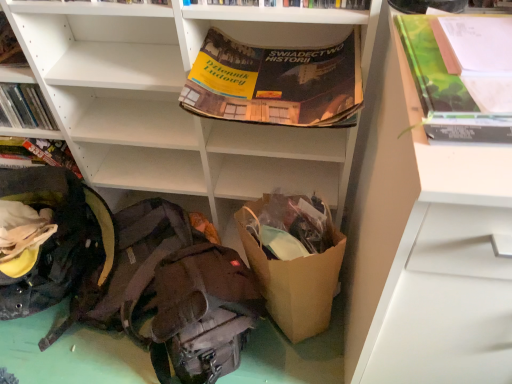
Question: From a real-world perspective, is dark brown fabric backpack at lower left, the third backpack from the left, on top of hardcover book at upper center, which is counted as the first book, starting from the front?

Choices:
 (A) no
 (B) yes

Answer: (A)

Question: Is dark brown fabric backpack at lower left, the third backpack from the left, positioned far away from hardcover book at upper center, which is the first book from top to bottom?

Choices:
 (A) no
 (B) yes

Answer: (A)

Question: Is hardcover book at upper center, marked as the second book in a back-to-front arrangement, inside dark brown fabric backpack at lower left, the third backpack from the left?

Choices:
 (A) yes
 (B) no

Answer: (B)

Question: Is dark brown fabric backpack at lower left, the third backpack from the left, aimed at hardcover book at upper center, which is the 1th book in right-to-left order?

Choices:
 (A) yes
 (B) no

Answer: (B)

Question: Does dark brown fabric backpack at lower left, the third backpack from the left, have a lesser height compared to hardcover book at upper center, which is the first book from top to bottom?

Choices:
 (A) yes
 (B) no

Answer: (B)

Question: Considering the relative sizes of dark brown fabric backpack at lower left, the 1th backpack when ordered from right to left, and hardcover book at upper center, which is the first book from top to bottom, in the image provided, is dark brown fabric backpack at lower left, the 1th backpack when ordered from right to left, bigger than hardcover book at upper center, which is the first book from top to bottom,?

Choices:
 (A) no
 (B) yes

Answer: (B)

Question: Is dark brown fabric backpack at lower left, the 1th backpack when ordered from right to left, oriented towards white matte shelf at upper center, positioned as the 1th shelf in left-to-right order?

Choices:
 (A) yes
 (B) no

Answer: (B)

Question: Is dark brown fabric backpack at lower left, the 1th backpack when ordered from right to left, smaller than white matte shelf at upper center, positioned as the 1th shelf in left-to-right order?

Choices:
 (A) yes
 (B) no

Answer: (A)

Question: Considering the relative sizes of dark brown fabric backpack at lower left, the 1th backpack when ordered from right to left, and white matte shelf at upper center, which ranks as the second shelf in right-to-left order, in the image provided, is dark brown fabric backpack at lower left, the 1th backpack when ordered from right to left, wider than white matte shelf at upper center, which ranks as the second shelf in right-to-left order,?

Choices:
 (A) no
 (B) yes

Answer: (B)

Question: Is white matte shelf at upper center, which ranks as the second shelf in right-to-left order, located within dark brown fabric backpack at lower left, the 1th backpack when ordered from right to left?

Choices:
 (A) no
 (B) yes

Answer: (A)

Question: Does dark brown fabric backpack at lower left, the third backpack from the left, have a greater height compared to white matte shelf at upper center, positioned as the 1th shelf in left-to-right order?

Choices:
 (A) yes
 (B) no

Answer: (B)

Question: Is the depth of dark brown fabric backpack at lower left, the third backpack from the left, less than that of white matte shelf at upper center, which ranks as the second shelf in right-to-left order?

Choices:
 (A) yes
 (B) no

Answer: (B)

Question: Is white matte drawer at right, the 1th shelf in the right-to-left sequence, beside white matte shelf at upper center, positioned as the 1th shelf in left-to-right order?

Choices:
 (A) no
 (B) yes

Answer: (A)